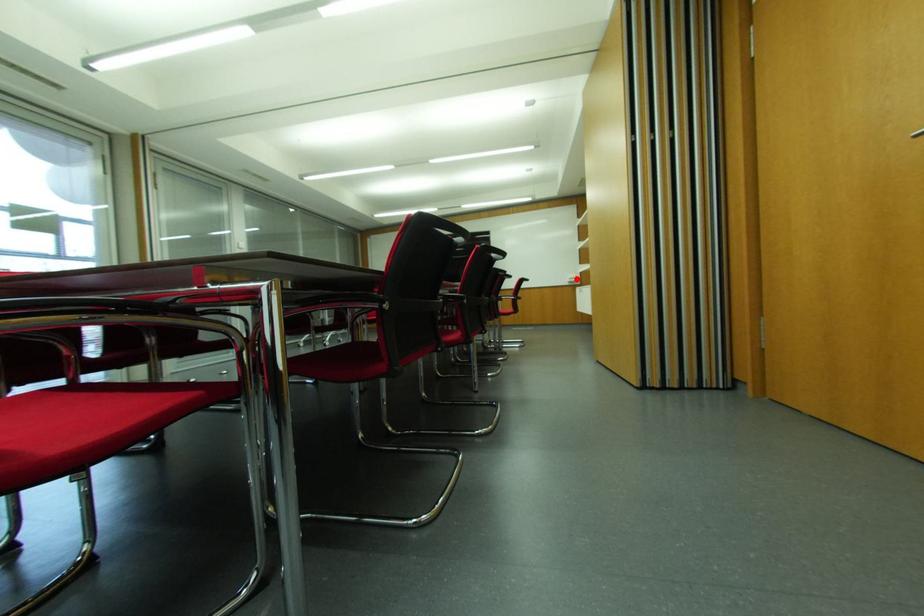
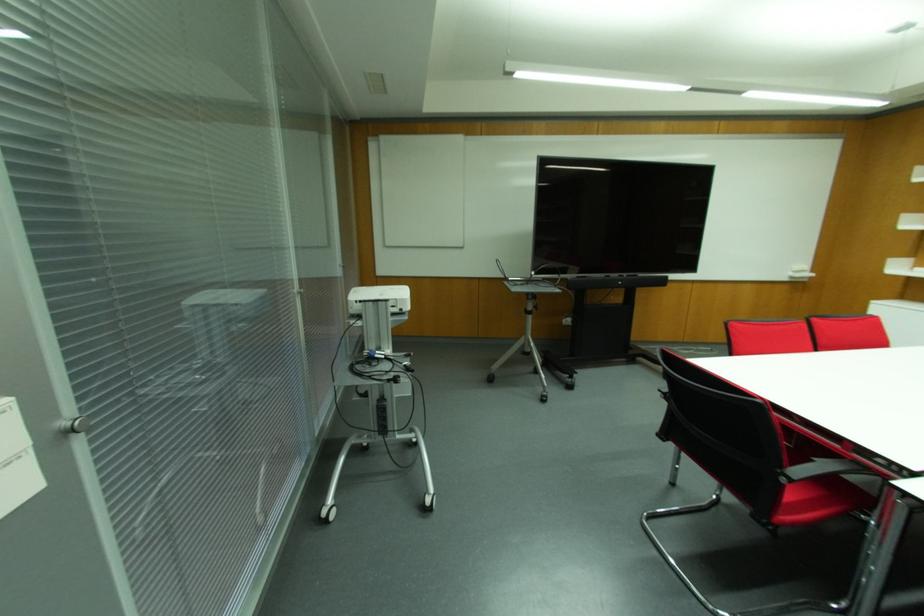
Question: I am providing you with two images of the same scene from different viewpoints. Given a red point in image1, look at the same physical point in image2. Is it:

Choices:
 (A) Closer to the viewpoint
 (B) Farther from the viewpoint

Answer: (B)